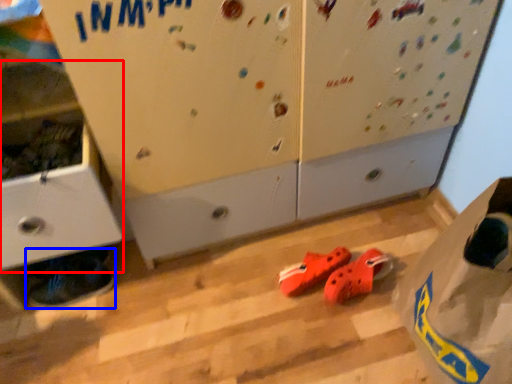
Question: Which of the following is the closest to the observer, cabinetry (highlighted by a red box) or footwear (highlighted by a blue box)?

Choices:
 (A) cabinetry
 (B) footwear

Answer: (A)